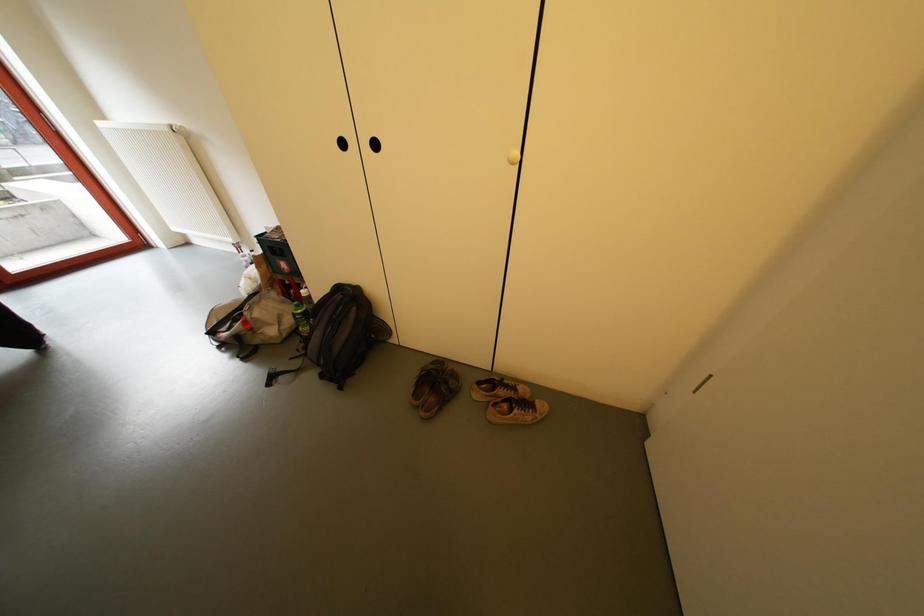
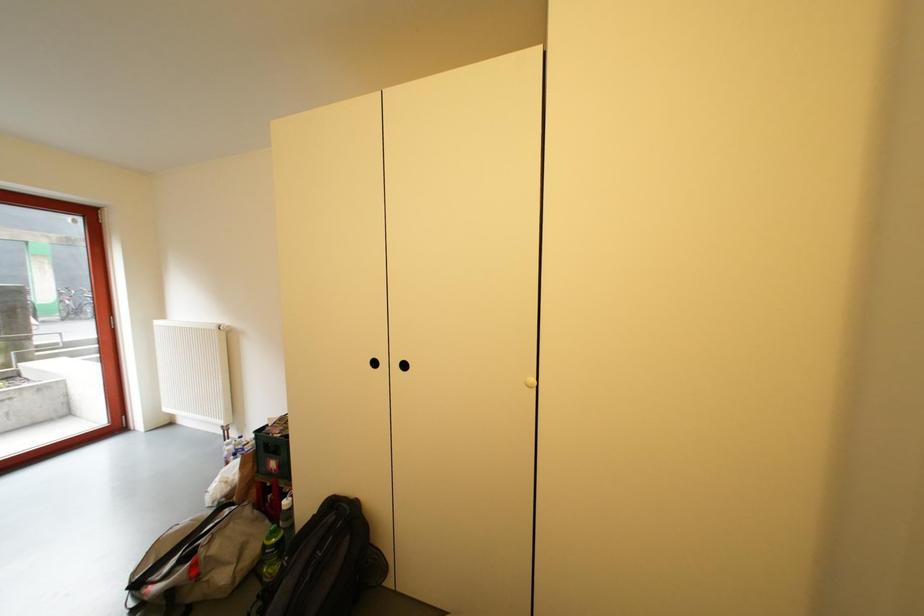
Question: Based on the continuous images, in which direction is the camera rotating? Reply with the corresponding letter.

Choices:
 (A) Left
 (B) Right
 (C) Up
 (D) Down

Answer: (C)